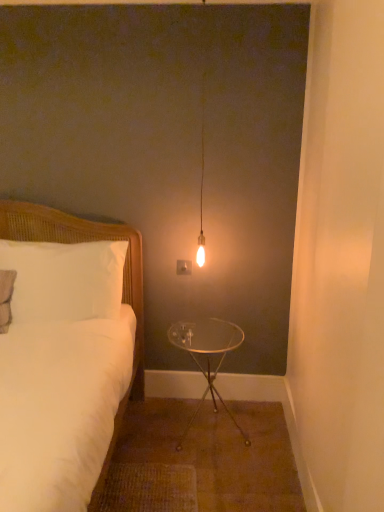
Question: Does point (94, 249) appear closer or farther from the camera than point (200, 98)?

Choices:
 (A) closer
 (B) farther

Answer: (A)

Question: From a real-world perspective, is white wicker pillow at left physically located above or below matte glass bulb at center?

Choices:
 (A) above
 (B) below

Answer: (B)

Question: Which object is the closest to the white wicker pillow at left?

Choices:
 (A) matte glass bulb at center
 (B) white woven bed at left
 (C) clear glass table at center

Answer: (B)

Question: Which object is positioned farthest from the clear glass table at center?

Choices:
 (A) white wicker pillow at left
 (B) white woven bed at left
 (C) matte glass bulb at center

Answer: (A)